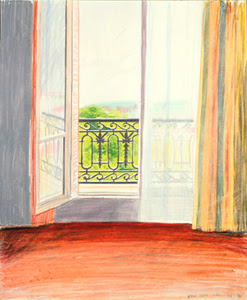
Identify the location of floor. The width and height of the screenshot is (247, 300). (128, 265).